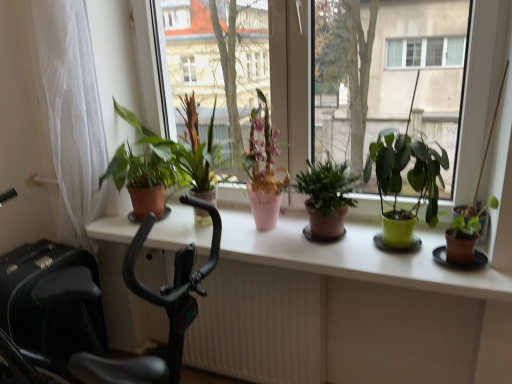
The width and height of the screenshot is (512, 384). Identify the location of vacant space in front of pink ceramic vase at center, which is the 4th houseplant from right to left. (265, 250).